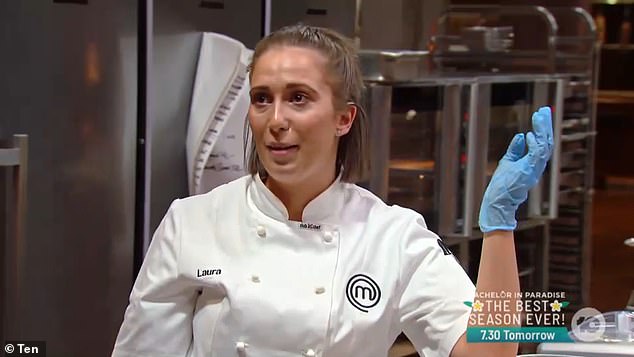
Locate an element on the screen. speedrack is located at coordinates (588, 35), (586, 237).